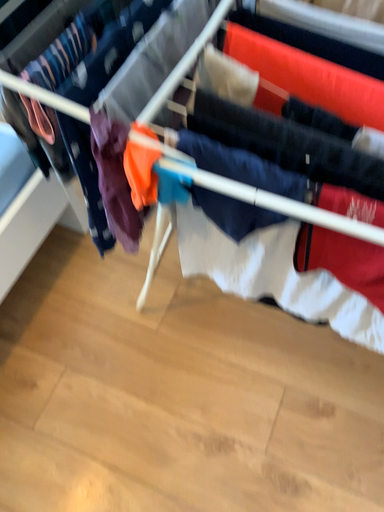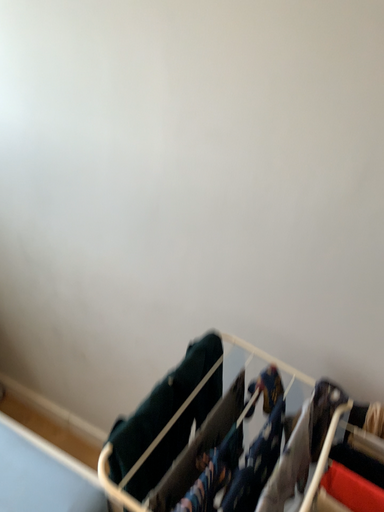
Question: Which way did the camera rotate in the video?

Choices:
 (A) rotated upward
 (B) rotated downward

Answer: (A)